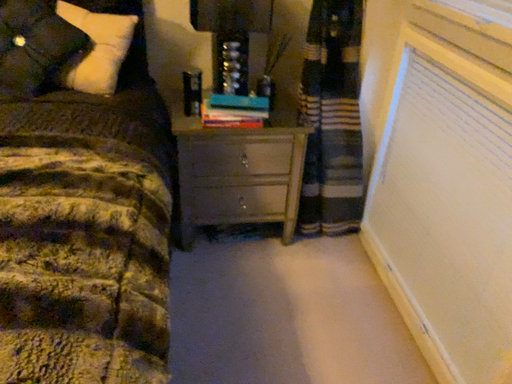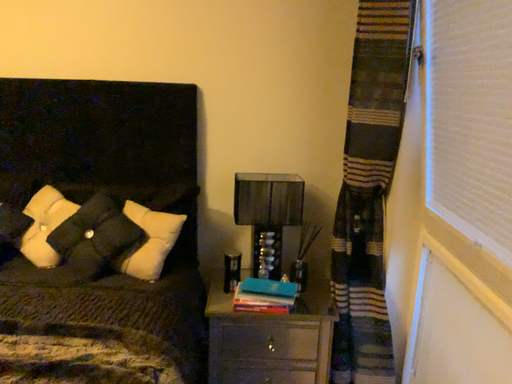
Question: How did the camera likely rotate when shooting the video?

Choices:
 (A) rotated upward
 (B) rotated downward

Answer: (A)